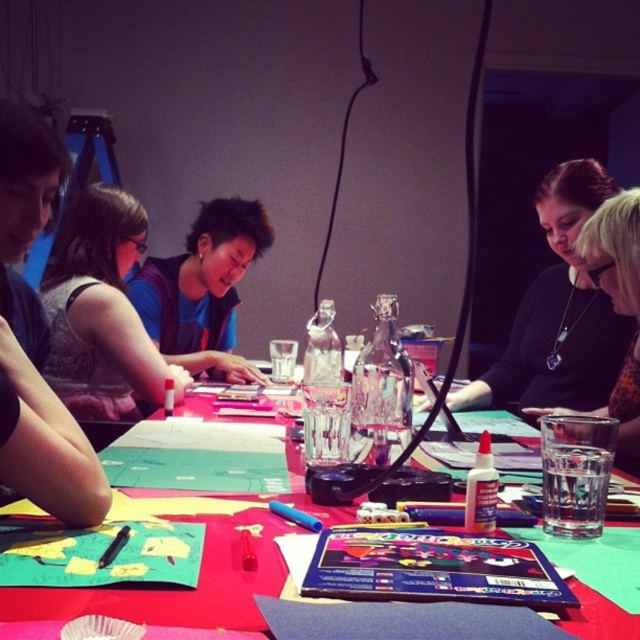
Please provide the 2D coordinates of the matte black marker at center in the image. The coordinates should be in the format of a tuple with two decimal numbers, like this example format. Please do not add any other information besides the coordinates.

The 2D coordinates of the matte black marker at center are at point (100, 310).

You are observing a group of people working on an art project at a table. You notice two items on the upper part of the image. One is a black matte shirt at upper center, and the other is a black necklace at upper right. From your perspective, which item is positioned more to the right?

The black matte shirt at upper center is positioned more to the right than the black necklace at upper right.

You are standing in the room and want to join the collaborative activity. Where should you go to find the red paper table at center?

The red paper table at center is located at point (173, 589), so you should go there to join the activity.